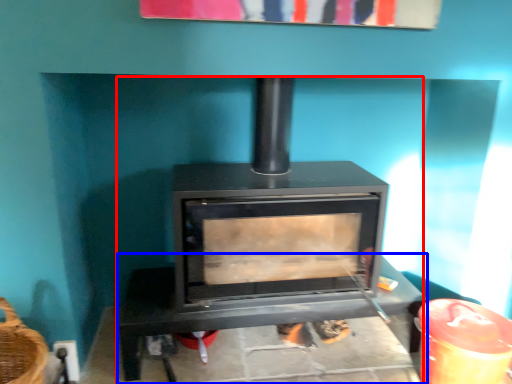
Question: Which of the following is the farthest to the observer, wood burning stove (highlighted by a red box) or furniture (highlighted by a blue box)?

Choices:
 (A) wood burning stove
 (B) furniture

Answer: (B)